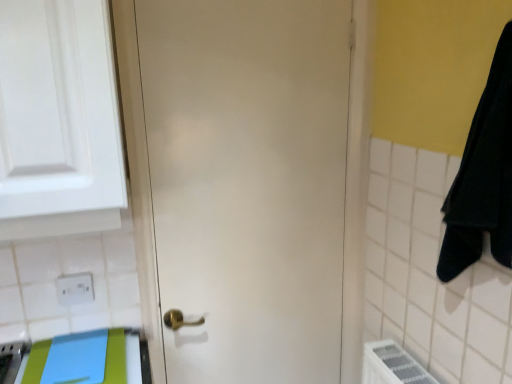
What do you see at coordinates (58, 120) in the screenshot?
I see `white glossy cabinet at upper left` at bounding box center [58, 120].

The height and width of the screenshot is (384, 512). What are the coordinates of `white plastic electric outlet at lower left` in the screenshot? It's located at (75, 288).

Locate an element on the screen. white glossy cabinet at upper left is located at coordinates (58, 120).

How distant is blue fabric beach towel at lower left from white glossy cabinet at upper left?

blue fabric beach towel at lower left and white glossy cabinet at upper left are 52.58 centimeters apart.

Is blue fabric beach towel at lower left in contact with white glossy cabinet at upper left?

No.

Is blue fabric beach towel at lower left smaller than white glossy cabinet at upper left?

Indeed, blue fabric beach towel at lower left has a smaller size compared to white glossy cabinet at upper left.

In terms of height, does blue fabric beach towel at lower left look taller or shorter compared to white glossy cabinet at upper left?

Clearly, blue fabric beach towel at lower left is shorter compared to white glossy cabinet at upper left.

This screenshot has width=512, height=384. What are the coordinates of `door below the white glossy cabinet at upper left (from the image's perspective)` in the screenshot? It's located at (238, 182).

Is white glossy cabinet at upper left wider or thinner than white matte door at center?

Clearly, white glossy cabinet at upper left has more width compared to white matte door at center.

Between white glossy cabinet at upper left and white matte door at center, which one is positioned in front?

white glossy cabinet at upper left is closer to the camera.

Does point (61, 112) come closer to viewer compared to point (182, 198)?

Yes, it is in front of point (182, 198).

Image resolution: width=512 pixels, height=384 pixels. Find the location of `medicine cabinet on the left of white matte door at center`. medicine cabinet on the left of white matte door at center is located at coordinates (58, 120).

Is the position of white matte door at center more distant than that of white glossy cabinet at upper left?

That is True.

Can you confirm if white matte door at center is shorter than white glossy cabinet at upper left?

No.

Is white matte door at center taller or shorter than white plastic electric outlet at lower left?

Considering their sizes, white matte door at center has more height than white plastic electric outlet at lower left.

Is white matte door at center behind white plastic electric outlet at lower left?

No, it is in front of white plastic electric outlet at lower left.

Which of these two, white matte door at center or white plastic electric outlet at lower left, is smaller?

Smaller between the two is white plastic electric outlet at lower left.

Can you confirm if white plastic electric outlet at lower left is positioned to the right of white matte door at center?

No.

Between white plastic electric outlet at lower left and white matte door at center, which one is positioned in front?

white matte door at center is in front.

Between point (67, 286) and point (204, 295), which one is positioned behind?

Point (204, 295)

Locate an element on the screen. The image size is (512, 384). electric outlet below the white matte door at center (from the image's perspective) is located at coordinates (75, 288).

Is white plastic electric outlet at lower left beside white glossy cabinet at upper left?

They are not placed beside each other.

Is the position of white plastic electric outlet at lower left more distant than that of white glossy cabinet at upper left?

Yes, white plastic electric outlet at lower left is behind white glossy cabinet at upper left.

Is point (58, 300) positioned behind point (102, 111)?

Yes.

How many degrees apart are the facing directions of white plastic electric outlet at lower left and white glossy cabinet at upper left?

They differ by 2.72 degrees in their facing directions.

Can you confirm if white glossy cabinet at upper left is smaller than blue fabric beach towel at lower left?

Incorrect, white glossy cabinet at upper left is not smaller in size than blue fabric beach towel at lower left.

Do you think white glossy cabinet at upper left is within blue fabric beach towel at lower left, or outside of it?

white glossy cabinet at upper left is located beyond the bounds of blue fabric beach towel at lower left.

Can you confirm if white glossy cabinet at upper left is positioned to the right of blue fabric beach towel at lower left?

Yes, white glossy cabinet at upper left is to the right of blue fabric beach towel at lower left.

Locate an element on the screen. beach towel on the left of white glossy cabinet at upper left is located at coordinates click(x=125, y=358).

You are a GUI agent. You are given a task and a screenshot of the screen. Output one action in this format:
    pyautogui.click(x=<x>, y=<y>)
    Task: Click on the medicine cabinet in front of the white matte door at center
    The height and width of the screenshot is (384, 512).
    Given the screenshot: What is the action you would take?
    pyautogui.click(x=58, y=120)

Looking at the image, which one is located closer to blue fabric beach towel at lower left, white glossy cabinet at upper left or white plastic electric outlet at lower left?

The object closer to blue fabric beach towel at lower left is white plastic electric outlet at lower left.

Considering their positions, is white matte door at center positioned closer to white plastic electric outlet at lower left than white glossy cabinet at upper left?

white glossy cabinet at upper left.

Estimate the real-world distances between objects in this image. Which object is further from white plastic electric outlet at lower left, white glossy cabinet at upper left or blue fabric beach towel at lower left?

white glossy cabinet at upper left is further to white plastic electric outlet at lower left.

Considering their positions, is blue fabric beach towel at lower left positioned further to white plastic electric outlet at lower left than white glossy cabinet at upper left?

Result: Among the two, white glossy cabinet at upper left is located further to white plastic electric outlet at lower left.

Estimate the real-world distances between objects in this image. Which object is further from white matte door at center, blue fabric beach towel at lower left or white glossy cabinet at upper left?

blue fabric beach towel at lower left is further to white matte door at center.

Considering their positions, is blue fabric beach towel at lower left positioned closer to white glossy cabinet at upper left than white matte door at center?

The object closer to white glossy cabinet at upper left is white matte door at center.

Looking at the image, which one is located closer to white matte door at center, blue fabric beach towel at lower left or white plastic electric outlet at lower left?

blue fabric beach towel at lower left lies closer to white matte door at center than the other object.

Based on their spatial positions, is white matte door at center or blue fabric beach towel at lower left closer to white glossy cabinet at upper left?

white matte door at center is positioned closer to the anchor white glossy cabinet at upper left.

Where is `electric outlet between white glossy cabinet at upper left and blue fabric beach towel at lower left vertically`? The height and width of the screenshot is (384, 512). electric outlet between white glossy cabinet at upper left and blue fabric beach towel at lower left vertically is located at coordinates (75, 288).

I want to click on beach towel between white plastic electric outlet at lower left and white matte door at center from left to right, so click(125, 358).

At what (x,y) coordinates should I click in order to perform the action: click on door between white glossy cabinet at upper left and blue fabric beach towel at lower left in the up-down direction. Please return your answer as a coordinate pair (x, y). Looking at the image, I should click on (238, 182).

This screenshot has height=384, width=512. Find the location of `medicine cabinet between white plastic electric outlet at lower left and white matte door at center`. medicine cabinet between white plastic electric outlet at lower left and white matte door at center is located at coordinates (58, 120).